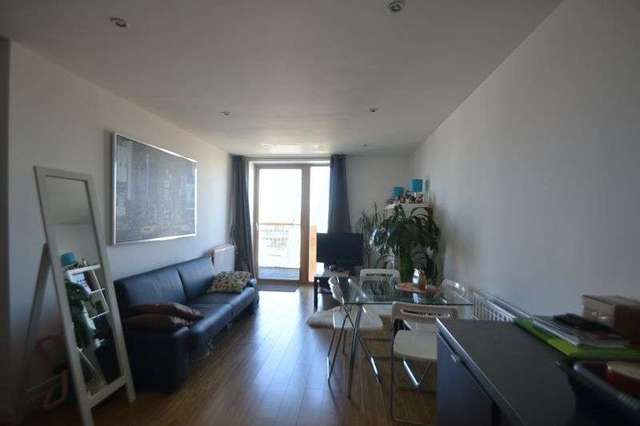
I want to click on couch, so 192,282, 169,286.